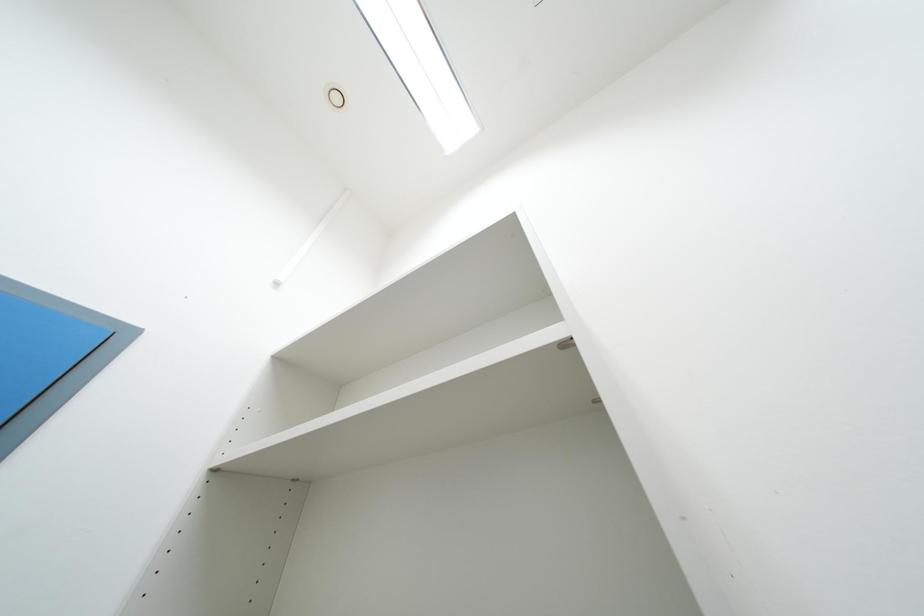
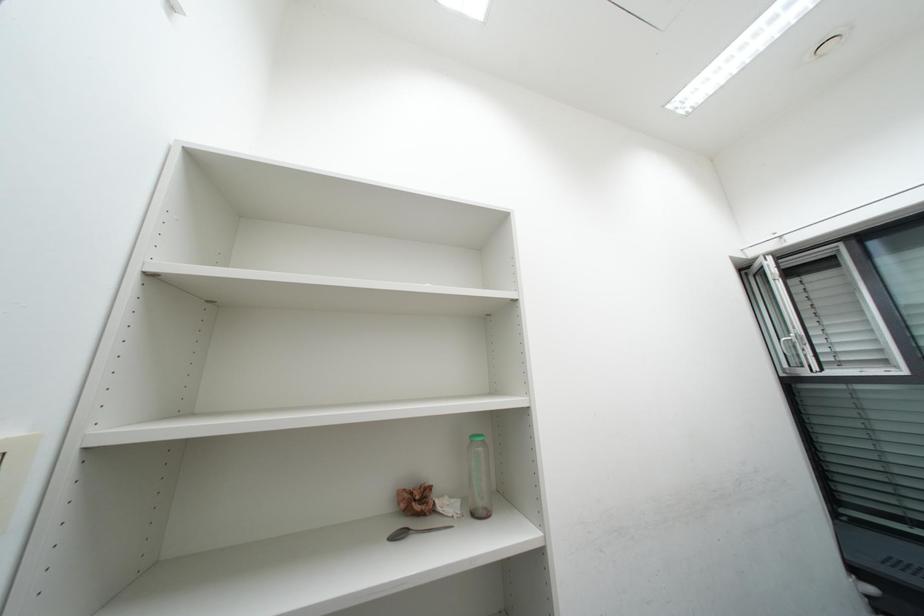
Question: The images are taken continuously from a first-person perspective. In which direction is your viewpoint rotating?

Choices:
 (A) Left
 (B) Right
 (C) Up
 (D) Down

Answer: (B)